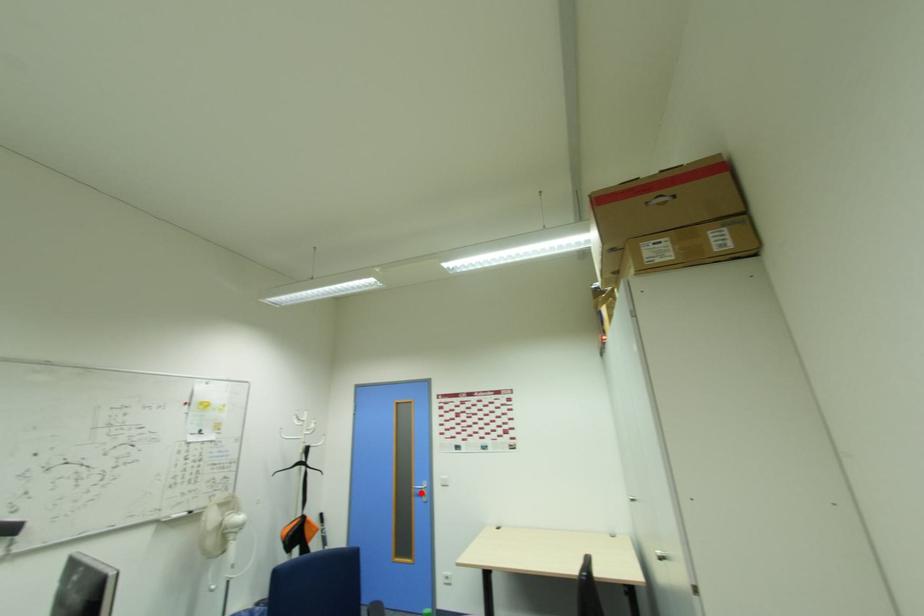
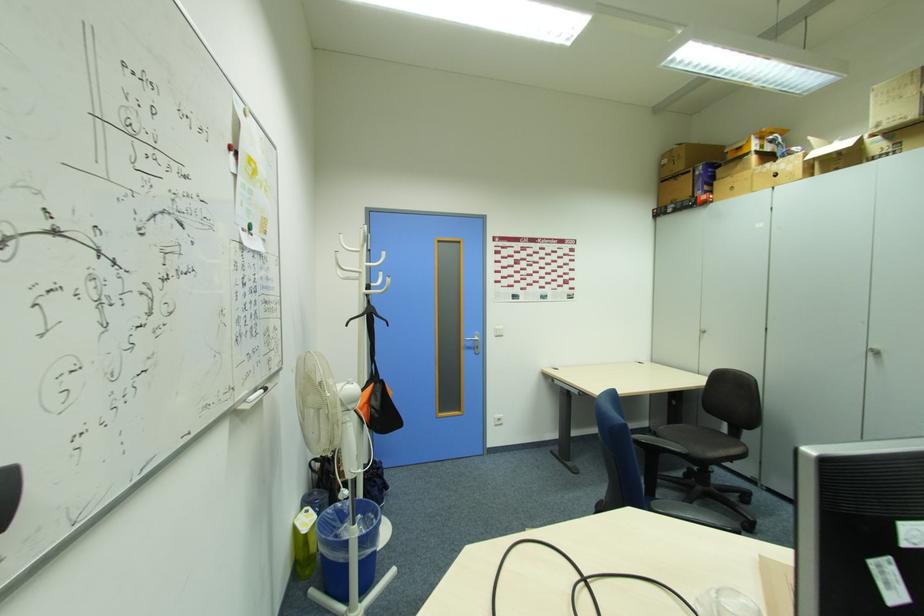
The point at the highlighted location is marked in the first image. Where is the corresponding point in the second image?

(472, 346)